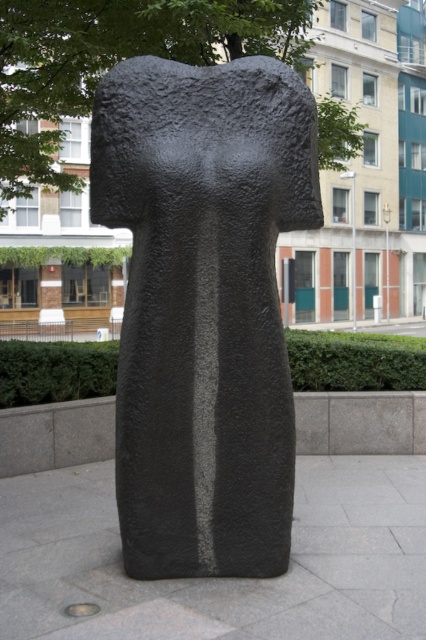
You are an artist planning to paint the scene. You need to decide which object to focus on first based on their widths. Which is wider, the black rough stone statue at center or the green leafy tree at upper center?

The green leafy tree at upper center is wider than the black rough stone statue at center.

You are a city planner assessing the sculpture and tree in the image. Which object is taller? Please refer to the sculpture labeled as the black rough stone statue at center and the tree labeled as the green leafy tree at upper center.

The green leafy tree at upper center is taller than the black rough stone statue at center.